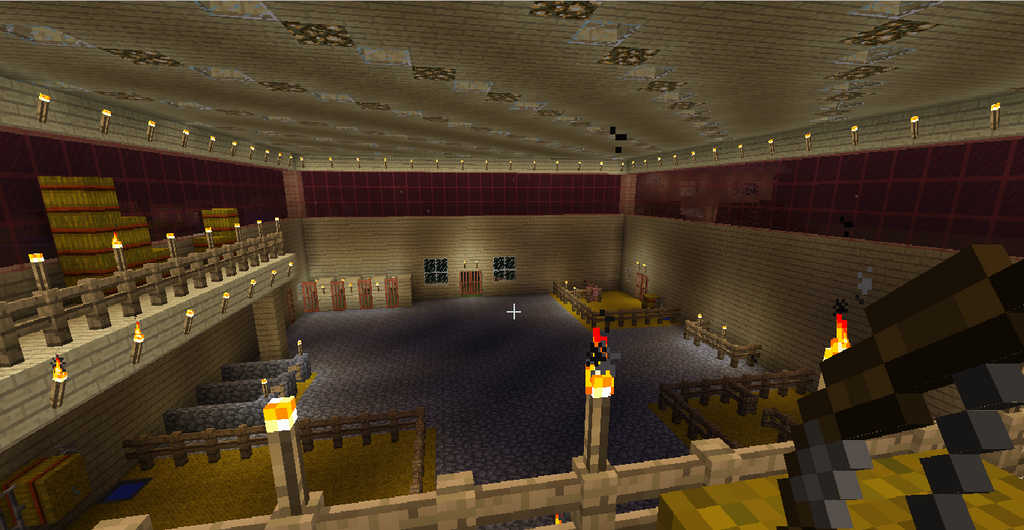
You are a GUI agent. You are given a task and a screenshot of the screen. Output one action in this format:
    pyautogui.click(x=<x>, y=<y>)
    Task: Click on the right wall
    This screenshot has width=1024, height=530.
    Given the screenshot: What is the action you would take?
    pyautogui.click(x=803, y=255)